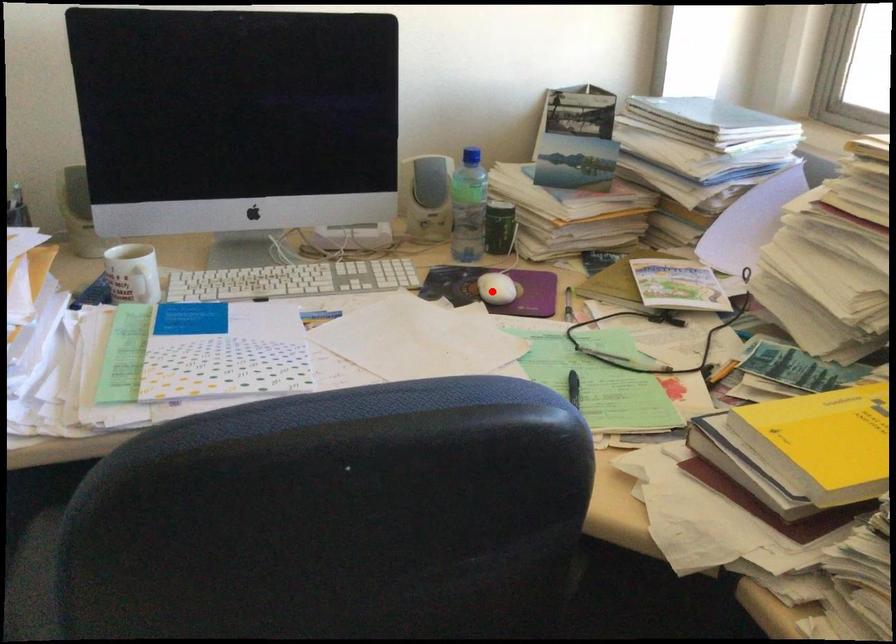
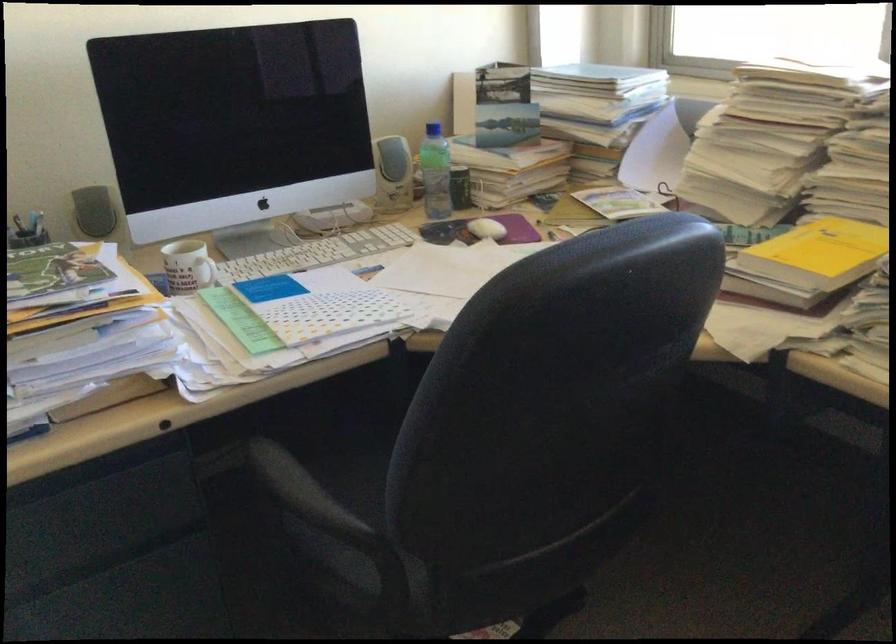
Question: I am providing you with two images of the same scene from different viewpoints. A red point is marked on the first image. Is the red point's position out of view in image 2?

Choices:
 (A) Yes
 (B) No

Answer: (B)